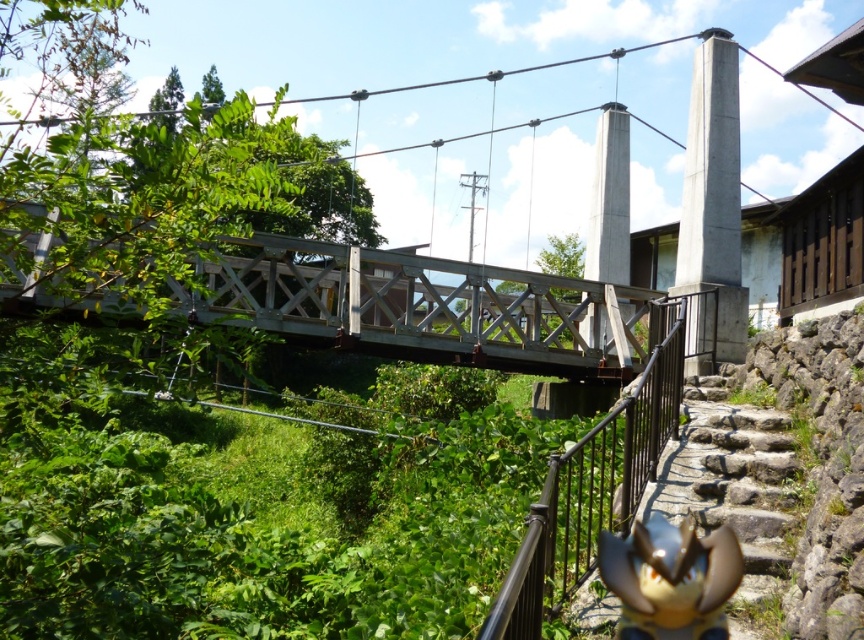
You are standing at the base of the stone staircase leading to the suspension bridge. You see two points marked in the scene. Which point is closer to you, point (335, 300) or point (651, 464)?

Point (335, 300) is closer to you because it is further to the camera than point (651, 464).

You are standing at the base of the stone staircase and want to walk towards the suspension bridge. There are two points marked on the path ahead of you. The first point is labeled as point (x=540, y=566) and the second is point (x=669, y=496). Which point will you reach first as you walk towards the bridge?

Point (x=540, y=566) is in front of point (x=669, y=496), so you will reach point (x=540, y=566) first as you walk towards the bridge.